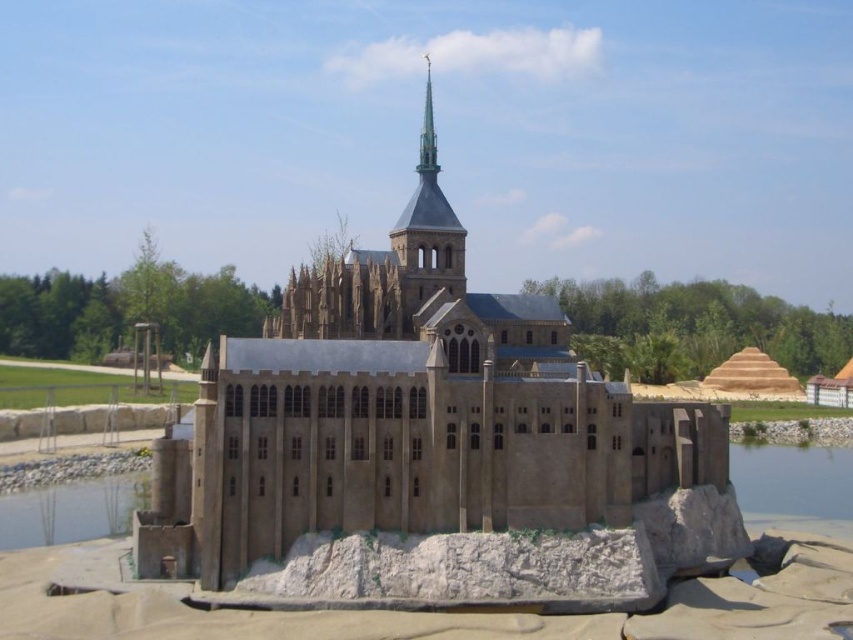
Question: Does beige stone church at center lie in front of clear water at lower left?

Choices:
 (A) yes
 (B) no

Answer: (A)

Question: Estimate the real-world distances between objects in this image. Which object is farther from the beige stone church at center?

Choices:
 (A) clear water at lower left
 (B) clear water at lower right

Answer: (B)

Question: Does clear water at lower right appear over clear water at lower left?

Choices:
 (A) yes
 (B) no

Answer: (A)

Question: Which point appears closest to the camera in this image?

Choices:
 (A) (247, 392)
 (B) (112, 529)

Answer: (A)

Question: Among these objects, which one is farthest from the camera?

Choices:
 (A) clear water at lower left
 (B) beige stone church at center

Answer: (A)

Question: In this image, where is clear water at lower right located relative to clear water at lower left?

Choices:
 (A) below
 (B) above

Answer: (B)